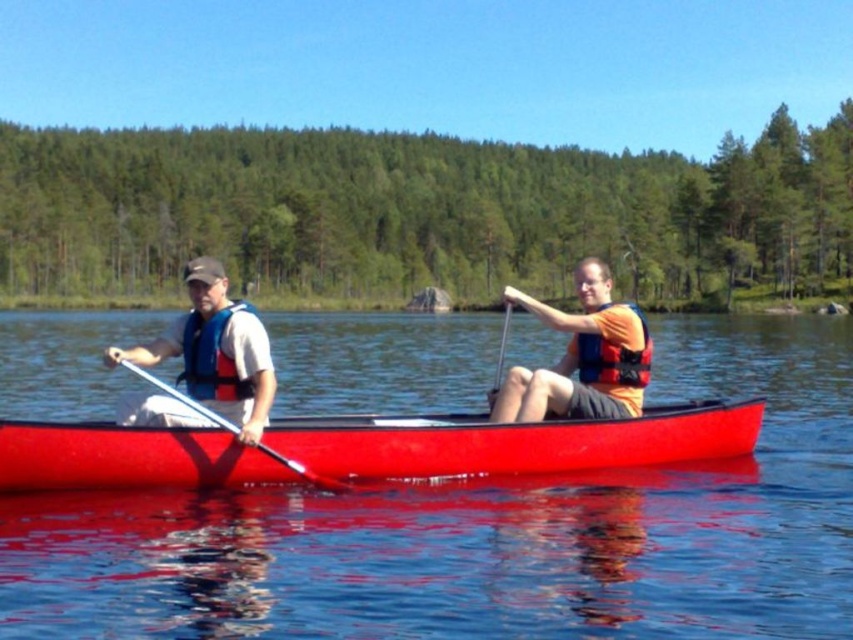
You are a safety inspector checking the canoe setup. You notice the orange fabric life jacket at center and the metallic silver paddle at left. According to safety regulations, life jackets must not be placed over paddles. Is the current arrangement compliant?

The orange fabric life jacket at center is positioned over the metallic silver paddle at left, which violates the safety regulation. The life jacket should not be placed over the paddle to ensure quick access during emergencies.

You are a safety inspector checking the placement of life jackets in a canoe. The orange life vest at center and the blue fabric life jacket at left must be arranged so that neither blocks the other. Based on the scene, which life jacket is positioned to the right of the other?

The orange life vest at center is positioned on the right side of blue fabric life jacket at left, so the orange life vest at center is to the right of the blue fabric life jacket at left.

You are a safety inspector checking the canoe setup. According to the image, is the smooth red canoe at center positioned correctly under the orange fabric life jacket at center for proper buoyancy?

The smooth red canoe at center is below orange fabric life jacket at center, so the life jacket is floating on top of the water, providing proper buoyancy as intended.